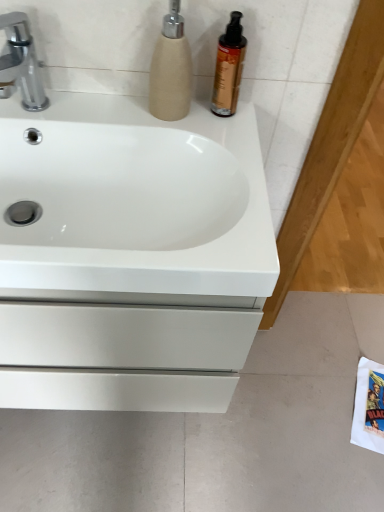
Find the location of a particular element. The height and width of the screenshot is (512, 384). vacant space to the right of beige textured soap dispenser at upper center is located at coordinates (224, 123).